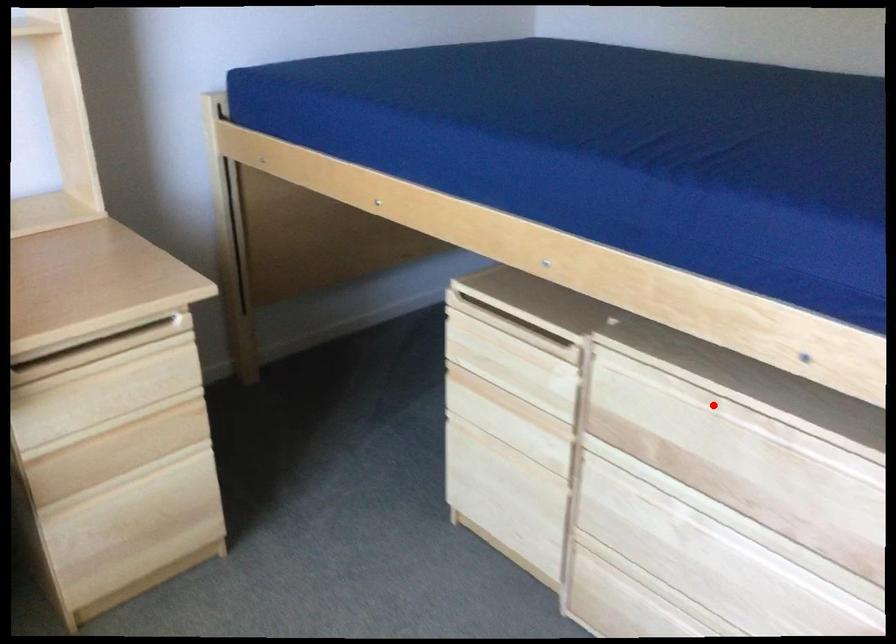
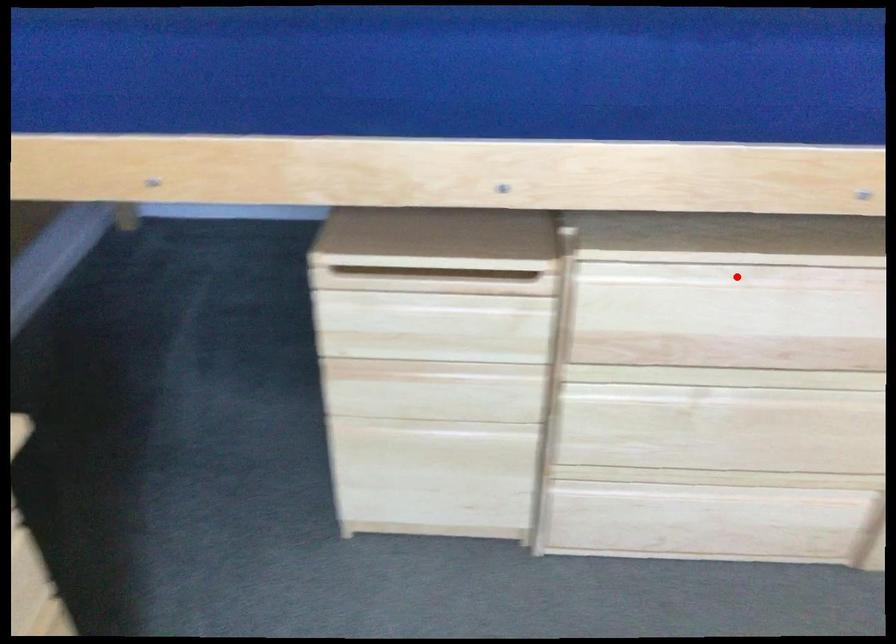
I am providing you with two images of the same scene from different viewpoints. A red point is marked on the first image and another point is marked on the second image. Is the marked point in image1 the same physical position as the marked point in image2?

Yes